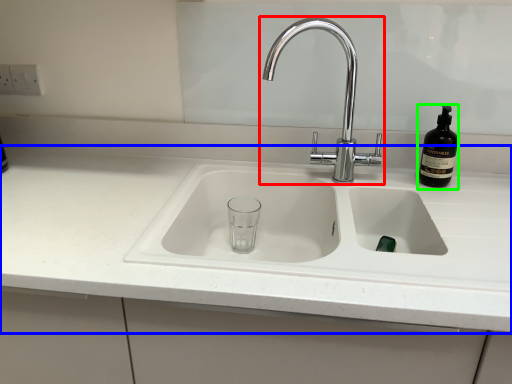
Question: Which object is the closest to the tap (highlighted by a red box)? Choose among these: countertop (highlighted by a blue box) or bottle (highlighted by a green box).

Choices:
 (A) countertop
 (B) bottle

Answer: (B)